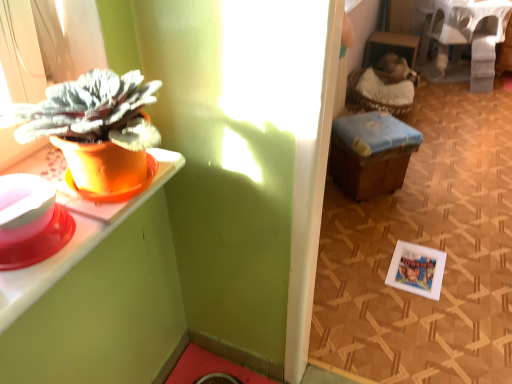
Question: Is white fabric-covered table at upper right wider or thinner than wooden stool at center?

Choices:
 (A) wide
 (B) thin

Answer: (A)

Question: Is white fabric-covered table at upper right taller or shorter than wooden stool at center?

Choices:
 (A) tall
 (B) short

Answer: (A)

Question: Which object is positioned farthest from the white fabric-covered table at upper right?

Choices:
 (A) white matte picture frame at lower right
 (B) orange matte pot at left
 (C) wooden stool at center

Answer: (B)

Question: Estimate the real-world distances between objects in this image. Which object is closer to the wooden stool at center?

Choices:
 (A) white matte picture frame at lower right
 (B) orange matte pot at left
 (C) white fabric-covered table at upper right

Answer: (A)